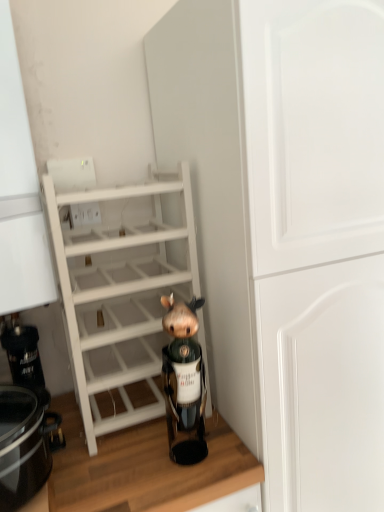
What is the approximate height of brown matte figurine at center?

The height of brown matte figurine at center is 39.01 centimeters.

Find the location of a particular element. This screenshot has width=384, height=512. wooden at lower center is located at coordinates (144, 468).

What do you see at coordinates (286, 228) in the screenshot? I see `white matte cabinet at center` at bounding box center [286, 228].

The image size is (384, 512). Identify the location of brown matte figurine at center. pos(184,382).

How distant is brown matte figurine at center from wooden at lower center?

A distance of 6.11 inches exists between brown matte figurine at center and wooden at lower center.

How many degrees apart are the facing directions of brown matte figurine at center and wooden at lower center?

They differ by 0.0004 degrees in their facing directions.

Can you see brown matte figurine at center touching wooden at lower center?

No, brown matte figurine at center is not beside wooden at lower center.

Do you think brown matte figurine at center is within wooden at lower center, or outside of it?

The correct answer is: outside.

Does brown matte figurine at center contain white wood shelf at center?

Definitely not — white wood shelf at center is not inside brown matte figurine at center.

Looking at this image, is brown matte figurine at center in front of or behind white wood shelf at center in the image?

Visually, brown matte figurine at center is located in front of white wood shelf at center.

Considering the sizes of objects brown matte figurine at center and white wood shelf at center in the image provided, who is shorter, brown matte figurine at center or white wood shelf at center?

With less height is brown matte figurine at center.

Is brown matte figurine at center at the left side of white wood shelf at center?

In fact, brown matte figurine at center is to the right of white wood shelf at center.

In the scene shown: Does white wood shelf at center have a greater height compared to brown matte figurine at center?

Indeed, white wood shelf at center has a greater height compared to brown matte figurine at center.

Is white wood shelf at center thinner than brown matte figurine at center?

In fact, white wood shelf at center might be wider than brown matte figurine at center.

Is white wood shelf at center facing away from brown matte figurine at center?

No.

Which is in front, white wood shelf at center or brown matte figurine at center?

brown matte figurine at center is more forward.

Which object is wider, white matte cabinet at center or wooden at lower center?

With larger width is white matte cabinet at center.

Is white matte cabinet at center touching wooden at lower center?

No, white matte cabinet at center is not beside wooden at lower center.

Which is more to the right, white matte cabinet at center or wooden at lower center?

white matte cabinet at center.

Is wooden at lower center outside of brown matte figurine at center?

Absolutely, wooden at lower center is external to brown matte figurine at center.

Considering the relative sizes of wooden at lower center and brown matte figurine at center in the image provided, is wooden at lower center smaller than brown matte figurine at center?

Incorrect, wooden at lower center is not smaller in size than brown matte figurine at center.

Consider the image. From the image's perspective, is wooden at lower center below brown matte figurine at center?

Yes, from the image's perspective, wooden at lower center is beneath brown matte figurine at center.

Can you confirm if wooden at lower center is thinner than brown matte figurine at center?

No, wooden at lower center is not thinner than brown matte figurine at center.

Which of these two, wooden at lower center or black glossy crock pot at lower left, stands shorter?

Standing shorter between the two is black glossy crock pot at lower left.

The image size is (384, 512). What are the coordinates of `counter top behind the black glossy crock pot at lower left` in the screenshot? It's located at (144, 468).

Is wooden at lower center oriented away from black glossy crock pot at lower left?

No, wooden at lower center's orientation is not away from black glossy crock pot at lower left.

Does point (64, 474) lie behind point (22, 406)?

No, it is in front of (22, 406).

From a real-world perspective, is white matte cabinet at center physically located above or below white wood shelf at center?

white matte cabinet at center is below white wood shelf at center.

From the image's perspective, who appears lower, white matte cabinet at center or white wood shelf at center?

From the image's view, white matte cabinet at center is below.

Is white matte cabinet at center not close to white wood shelf at center?

white matte cabinet at center is actually quite close to white wood shelf at center.

In the scene shown: Does white matte cabinet at center turn towards white wood shelf at center?

No, white matte cabinet at center is not facing towards white wood shelf at center.

Identify the location of counter top in front of the brown matte figurine at center. The image size is (384, 512). (144, 468).

In order to click on figurine that is under the white wood shelf at center (from a real-world perspective) in this screenshot , I will do `click(184, 382)`.

Estimate the real-world distances between objects in this image. Which object is closer to wooden at lower center, white wood shelf at center or brown matte figurine at center?

Among the two, brown matte figurine at center is located nearer to wooden at lower center.

Estimate the real-world distances between objects in this image. Which object is further from black glossy crock pot at lower left, wooden at lower center or white matte cabinet at center?

white matte cabinet at center is further to black glossy crock pot at lower left.

From the image, which object appears to be farther from white matte cabinet at center, black glossy crock pot at lower left or brown matte figurine at center?

black glossy crock pot at lower left.

Estimate the real-world distances between objects in this image. Which object is further from white wood shelf at center, brown matte figurine at center or white matte cabinet at center?

The object further to white wood shelf at center is white matte cabinet at center.

Considering their positions, is black glossy crock pot at lower left positioned further to wooden at lower center than white matte cabinet at center?

white matte cabinet at center is positioned further to the anchor wooden at lower center.

When comparing their distances from white matte cabinet at center, does black glossy crock pot at lower left or wooden at lower center seem closer?

wooden at lower center is positioned closer to the anchor white matte cabinet at center.

Estimate the real-world distances between objects in this image. Which object is further from white wood shelf at center, black glossy crock pot at lower left or wooden at lower center?

black glossy crock pot at lower left is positioned further to the anchor white wood shelf at center.

Considering their positions, is white matte cabinet at center positioned closer to white wood shelf at center than black glossy crock pot at lower left?

→ The object closer to white wood shelf at center is white matte cabinet at center.

Locate an element on the screen. This screenshot has width=384, height=512. crock pot that lies between white wood shelf at center and wooden at lower center from top to bottom is located at coordinates (23, 446).

The height and width of the screenshot is (512, 384). Find the location of `crock pot between brown matte figurine at center and wooden at lower center in the vertical direction`. crock pot between brown matte figurine at center and wooden at lower center in the vertical direction is located at coordinates (23, 446).

Find the location of a particular element. counter top between black glossy crock pot at lower left and white matte cabinet at center from left to right is located at coordinates (144, 468).

I want to click on figurine between white wood shelf at center and wooden at lower center in the vertical direction, so click(x=184, y=382).